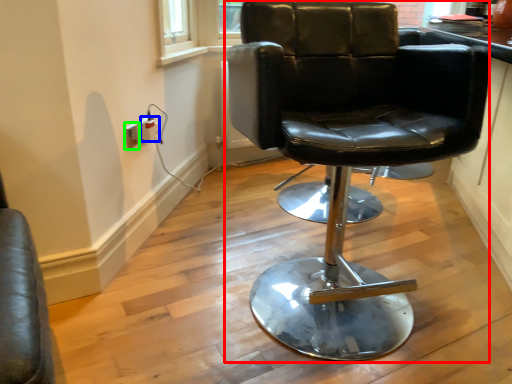
Question: Estimate the real-world distances between objects in this image. Which object is farther from chair (highlighted by a red box), electric outlet (highlighted by a blue box) or electric outlet (highlighted by a green box)?

Choices:
 (A) electric outlet
 (B) electric outlet

Answer: (A)